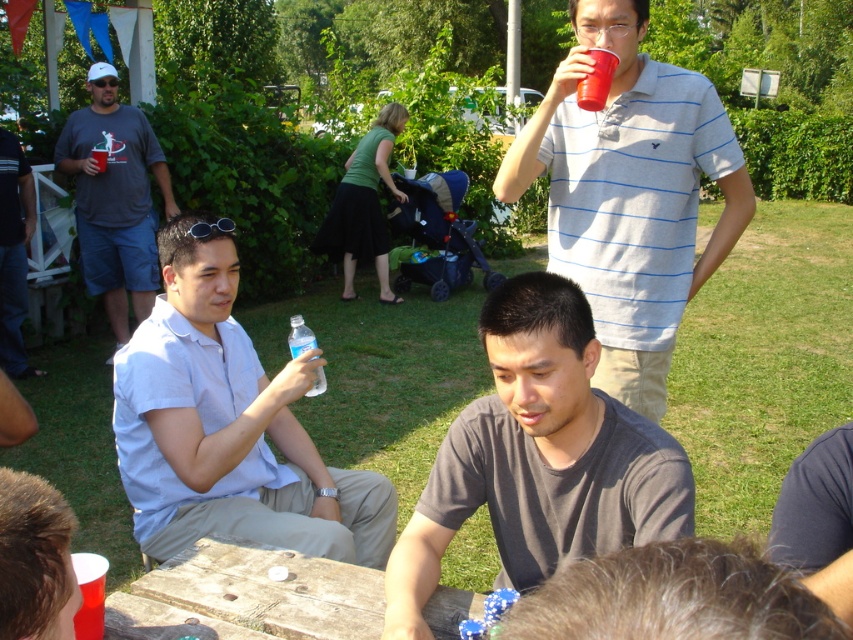
You are standing at the point labeled point (544, 145) and want to walk to the point labeled point (154, 157). Which direction should you face to move towards your destination?

Since point (544, 145) is closer to the viewer than point (154, 157), you should face downward to move towards your destination.

You are standing at the point marked by the coordinates point (630, 193). Looking around, you see a man in a gray striped polo shirt at upper center. Which direction should you walk to reach the man in the light blue shirt and beige pants seated at the wooden table?

The point (630, 193) corresponds to the gray striped polo shirt at upper center. To reach the man in the light blue shirt and beige pants seated at the wooden table, you should walk downward since the seated man is lower in the image compared to the gray striped polo shirt at upper center.